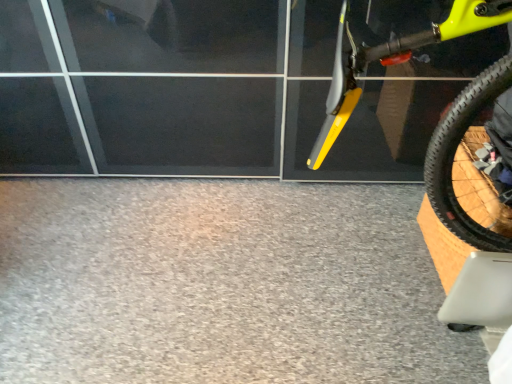
Question: Is gray carpet at lower center to the left or to the right of yellow matte bicycle at right in the image?

Choices:
 (A) right
 (B) left

Answer: (B)

Question: In terms of size, does gray carpet at lower center appear bigger or smaller than yellow matte bicycle at right?

Choices:
 (A) small
 (B) big

Answer: (A)

Question: Is gray carpet at lower center wider or thinner than yellow matte bicycle at right?

Choices:
 (A) wide
 (B) thin

Answer: (A)

Question: In terms of width, does yellow matte bicycle at right look wider or thinner when compared to gray carpet at lower center?

Choices:
 (A) thin
 (B) wide

Answer: (A)

Question: Considering the positions of yellow matte bicycle at right and gray carpet at lower center in the image, is yellow matte bicycle at right taller or shorter than gray carpet at lower center?

Choices:
 (A) tall
 (B) short

Answer: (A)

Question: Relative to gray carpet at lower center, is yellow matte bicycle at right in front or behind?

Choices:
 (A) front
 (B) behind

Answer: (A)

Question: Visually, is yellow matte bicycle at right positioned to the left or to the right of gray carpet at lower center?

Choices:
 (A) right
 (B) left

Answer: (A)